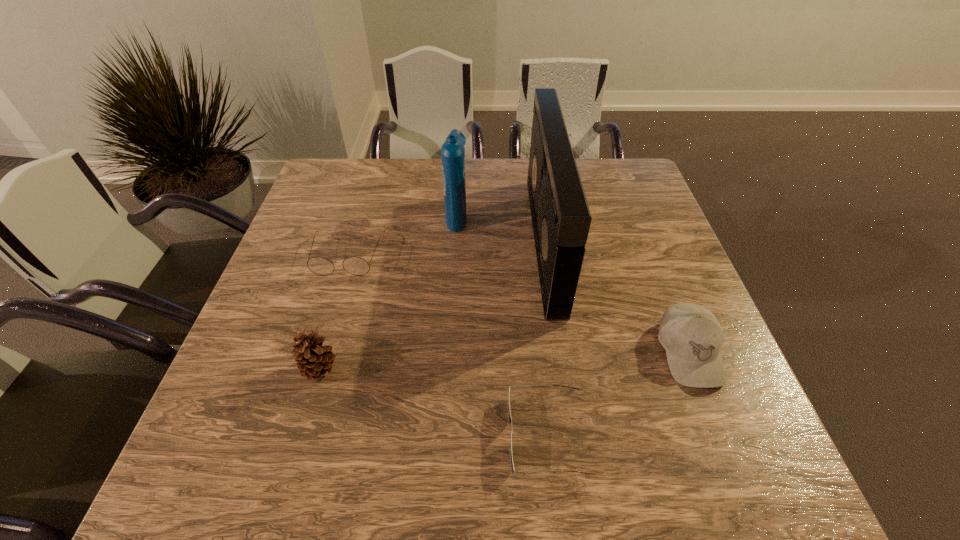
This screenshot has height=540, width=960. In order to click on free space between the spectacles and the shampoo in this screenshot , I will do (x=402, y=236).

Where is `empty space that is in between the rightmost object and the spectacles`? The image size is (960, 540). empty space that is in between the rightmost object and the spectacles is located at coordinates (518, 305).

The image size is (960, 540). Find the location of `vacant point located between the shampoo and the pinecone`. vacant point located between the shampoo and the pinecone is located at coordinates [389, 292].

Find the location of `empty location between the fourth shortest object and the nearest object`. empty location between the fourth shortest object and the nearest object is located at coordinates (434, 402).

Locate an element on the screen. free space between the videotape and the second shortest object is located at coordinates (446, 249).

Locate an element on the screen. The width and height of the screenshot is (960, 540). unoccupied area between the pinecone and the shampoo is located at coordinates (x=389, y=292).

Identify the location of free space between the fourth shortest object and the videotape. (433, 305).

In order to click on free space between the fifth tallest object and the shortest object in this screenshot , I will do `click(447, 346)`.

The image size is (960, 540). I want to click on free space between the pinecone and the videotape, so click(x=433, y=305).

Identify which object is the nearest to the third object from left to right. Please provide its 2D coordinates. Your answer should be formatted as a tuple, i.e. [(x, y)], where the tuple contains the x and y coordinates of a point satisfying the conditions above.

[(357, 266)]